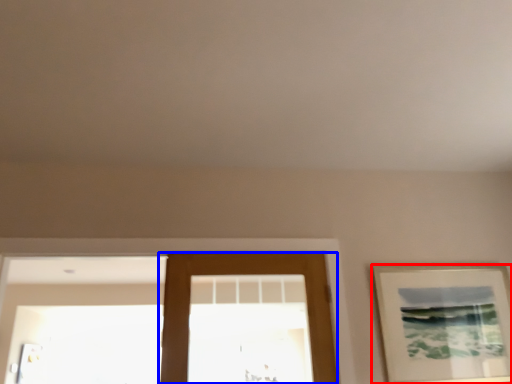
Question: Which of the following is the closest to the observer, picture frame (highlighted by a red box) or door (highlighted by a blue box)?

Choices:
 (A) picture frame
 (B) door

Answer: (B)